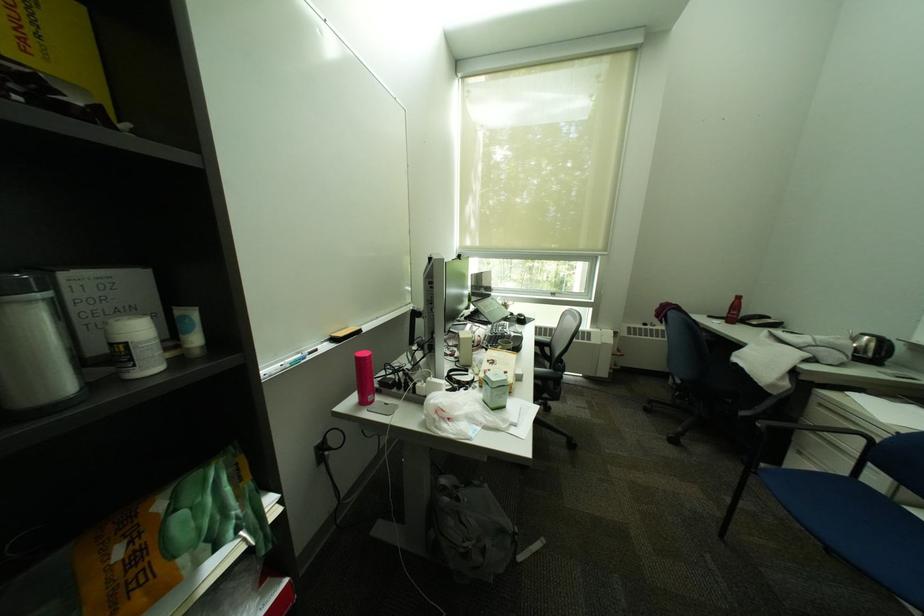
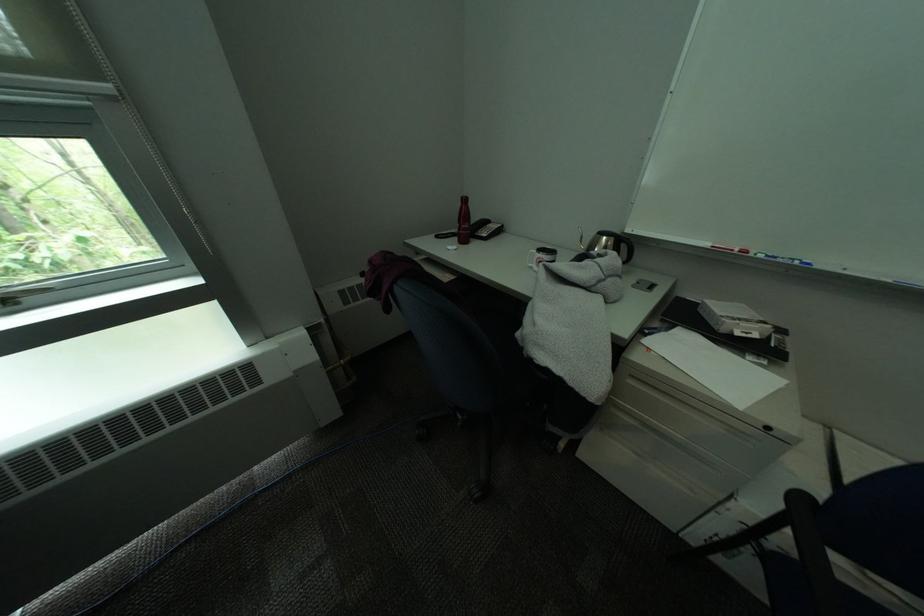
The point at (x=564, y=294) is marked in the first image. Where is the corresponding point in the second image?

(15, 302)